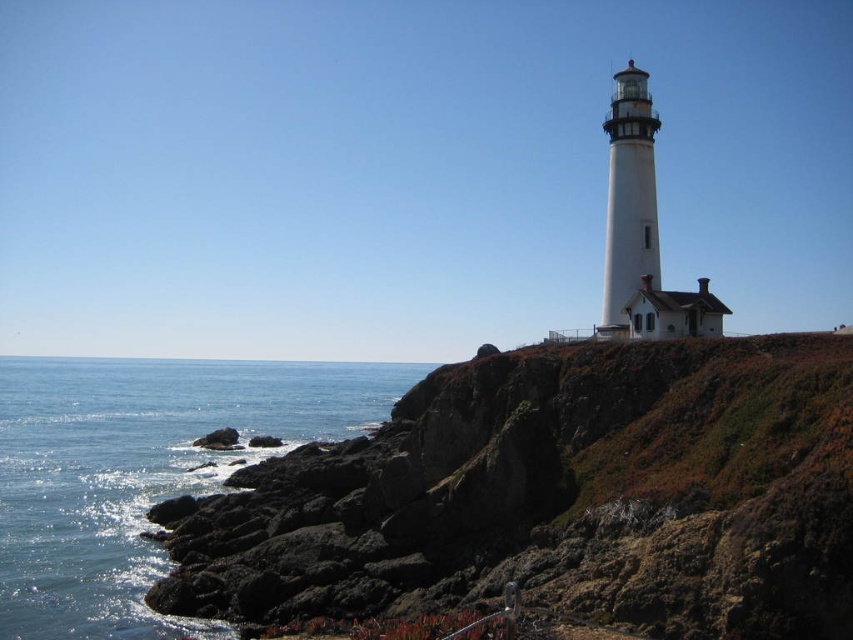
Who is positioned more to the left, rough volcanic rock at center or blue water at lower left?

blue water at lower left

Does rough volcanic rock at center have a greater height compared to blue water at lower left?

Yes, rough volcanic rock at center is taller than blue water at lower left.

Find the location of a particular element. rough volcanic rock at center is located at coordinates (556, 497).